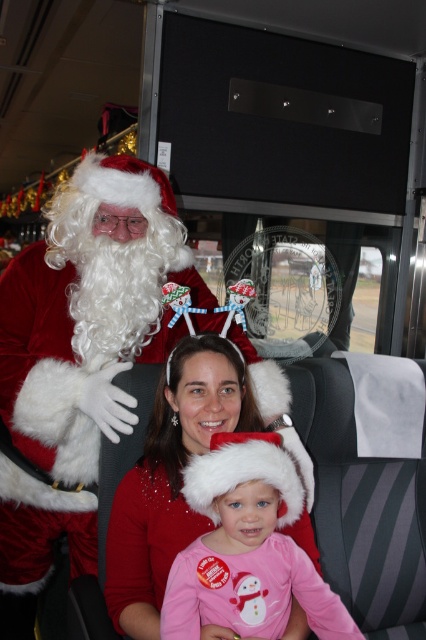
You are a passenger on this bus and want to know if the two points marked in the image are positioned such that one is behind the other. Based on the scene, can you determine if point at [235,420] is behind point at [241,572]?

Yes, according to the description, point at [235,420] is behind point at [241,572].

You are a passenger on the bus and want to take a photo of the velvet santa claus at upper left. The bus window is at the back of the bus. Where should you position yourself to take the photo without any obstruction?

Answer: Since the velvet santa claus at upper left is positioned at point (80, 352), you should move to the front of the bus near the driver to ensure a clear view of the Santa Claus without any obstructions from the window at the back.